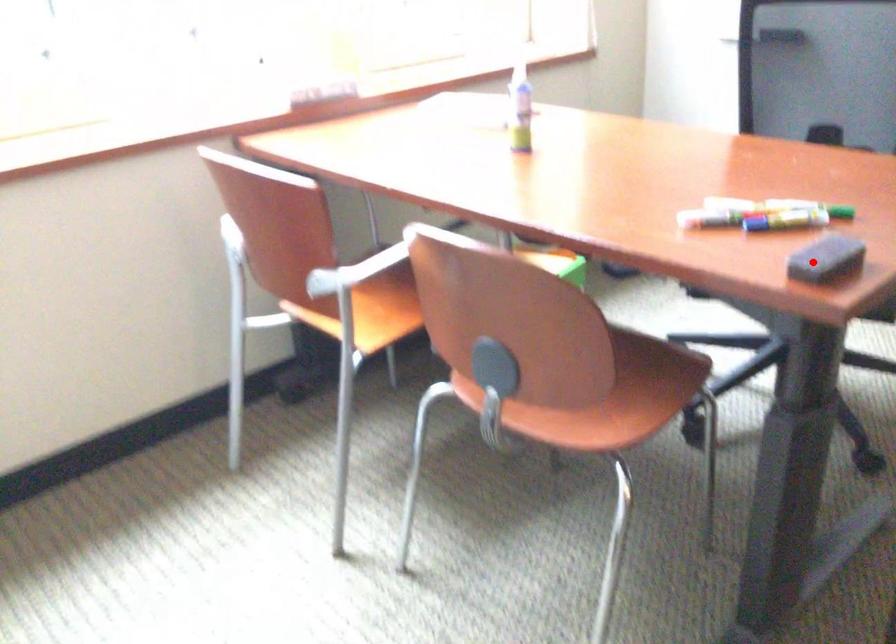
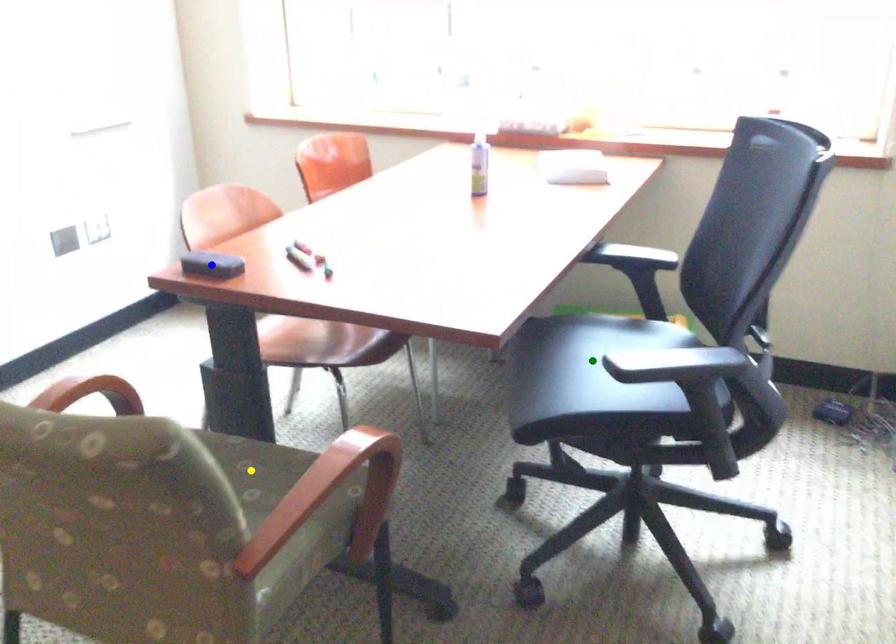
Question: I am providing you with two images of the same scene from different viewpoints. A red point is marked on the first image. You are given multiple points on the second image. Which point in image 2 represents the same 3d spot as the red point in image 1?

Choices:
 (A) blue point
 (B) yellow point
 (C) green point

Answer: (A)